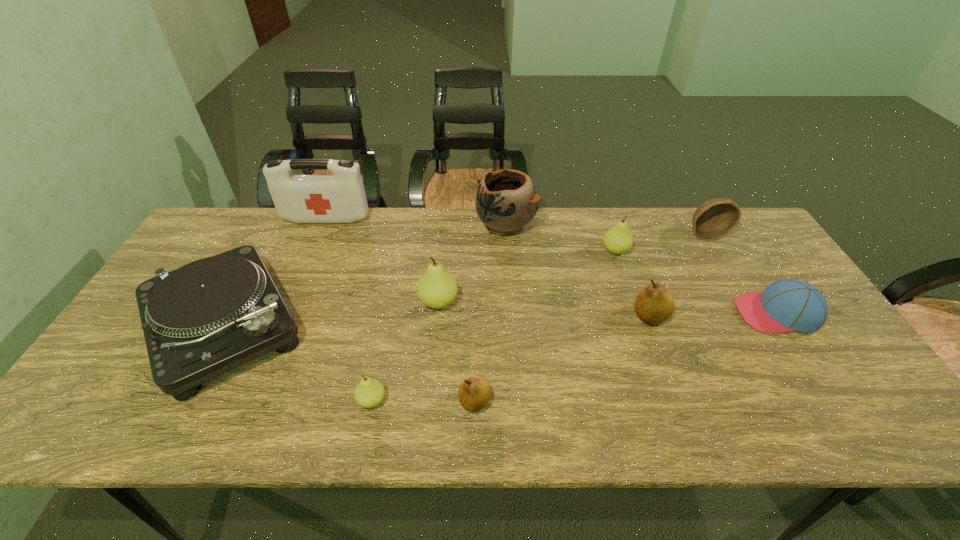
Identify the location of vacant space that's between the bowl and the baseball cap. The image size is (960, 540). coord(741,274).

Where is `unoccupied area between the smaller brown pear and the pottery`? Image resolution: width=960 pixels, height=540 pixels. unoccupied area between the smaller brown pear and the pottery is located at coordinates (491, 313).

This screenshot has height=540, width=960. I want to click on free space between the red first-aid kit and the blue baseball cap, so click(551, 266).

You are a GUI agent. You are given a task and a screenshot of the screen. Output one action in this format:
    pyautogui.click(x=<x>, y=<y>)
    Task: Click on the eighth closest object to the red first-aid kit
    
    Given the screenshot: What is the action you would take?
    pyautogui.click(x=713, y=219)

I want to click on object that is the fourth closest to the bowl, so click(506, 201).

Locate which pear is the fourth closest to the second farthest green pear. Please provide its 2D coordinates. Your answer should be formatted as a tuple, i.e. [(x, y)], where the tuple contains the x and y coordinates of a point satisfying the conditions above.

[(654, 304)]

Locate which pear is the closest to the farthest pear. Please provide its 2D coordinates. Your answer should be formatted as a tuple, i.e. [(x, y)], where the tuple contains the x and y coordinates of a point satisfying the conditions above.

[(654, 304)]

Identify which green pear is the closest to the tallest object. Please provide its 2D coordinates. Your answer should be formatted as a tuple, i.e. [(x, y)], where the tuple contains the x and y coordinates of a point satisfying the conditions above.

[(436, 288)]

Select which green pear appears as the second closest to the blue pottery. Please provide its 2D coordinates. Your answer should be formatted as a tuple, i.e. [(x, y)], where the tuple contains the x and y coordinates of a point satisfying the conditions above.

[(436, 288)]

You are a GUI agent. You are given a task and a screenshot of the screen. Output one action in this format:
    pyautogui.click(x=<x>, y=<y>)
    Task: Click on the vacant region that satisfies the following two spatial constraints: 1. on the back side of the rightmost green pear; 2. on the right side of the bowl
    The height and width of the screenshot is (540, 960).
    Given the screenshot: What is the action you would take?
    pyautogui.click(x=610, y=234)